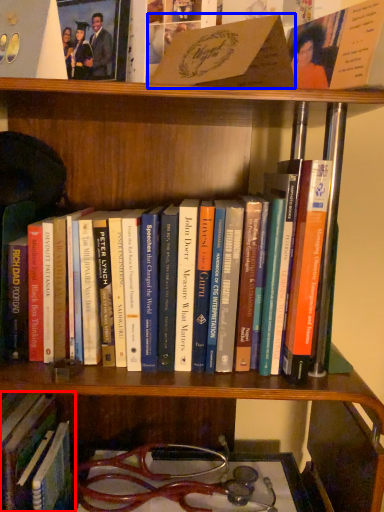
Question: Among these objects, which one is nearest to the camera, book (highlighted by a red box) or book (highlighted by a blue box)?

Choices:
 (A) book
 (B) book

Answer: (B)